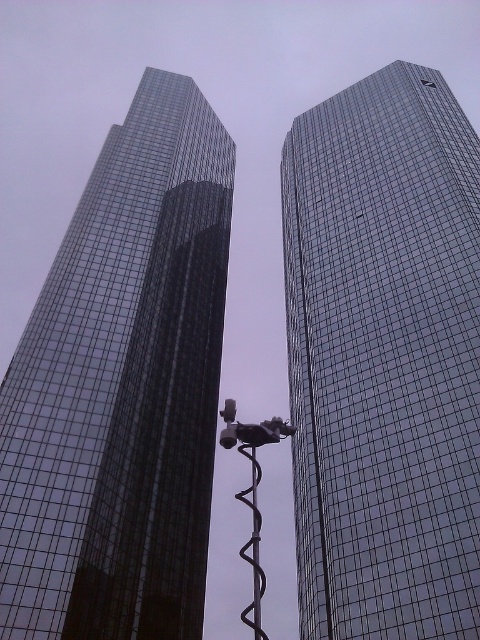
Is glassy reflective skyscraper at right bigger than glassy reflective skyscraper at left?

Yes, glassy reflective skyscraper at right is bigger than glassy reflective skyscraper at left.

Looking at this image, is glassy reflective skyscraper at right to the left of glassy reflective skyscraper at left from the viewer's perspective?

No, glassy reflective skyscraper at right is not to the left of glassy reflective skyscraper at left.

At what (x,y) coordinates should I click in order to perform the action: click on glassy reflective skyscraper at right. Please return your answer as a coordinate pair (x, y). This screenshot has height=640, width=480. Looking at the image, I should click on (384, 358).

Is point (351, 454) closer to camera compared to point (254, 598)?

Yes, it is in front of point (254, 598).

You are a GUI agent. You are given a task and a screenshot of the screen. Output one action in this format:
    pyautogui.click(x=<x>, y=<y>)
    Task: Click on the glassy reflective skyscraper at right
    
    Given the screenshot: What is the action you would take?
    pyautogui.click(x=384, y=358)

Does glassy reflective skyscraper at left lie behind black rubber pole at center?

Yes, it is.

Does glassy reflective skyscraper at left have a larger size compared to black rubber pole at center?

Correct, glassy reflective skyscraper at left is larger in size than black rubber pole at center.

This screenshot has height=640, width=480. I want to click on glassy reflective skyscraper at left, so click(121, 388).

The height and width of the screenshot is (640, 480). Identify the location of glassy reflective skyscraper at left. (121, 388).